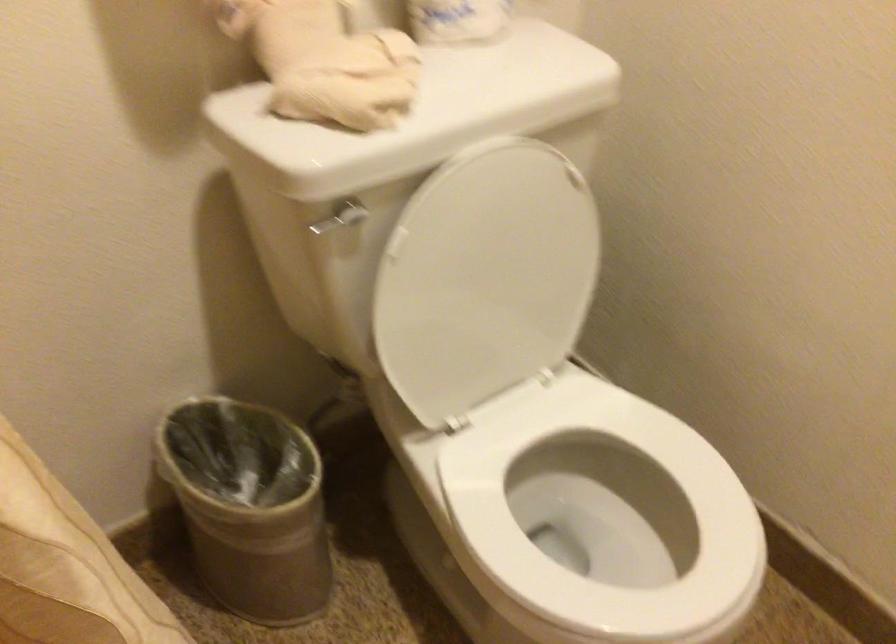
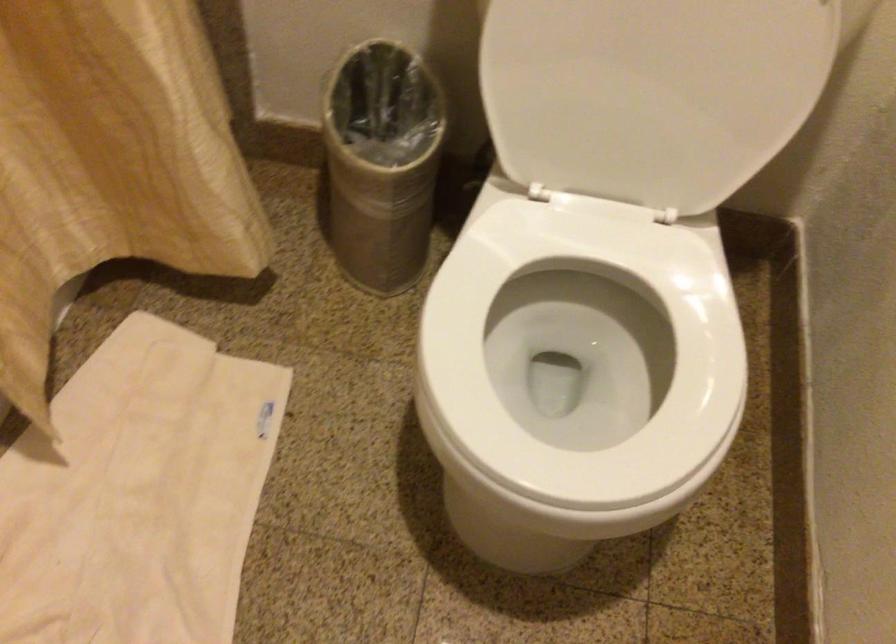
First-person continuous shooting, in which direction is the camera rotating?

The camera rotated toward left-down.